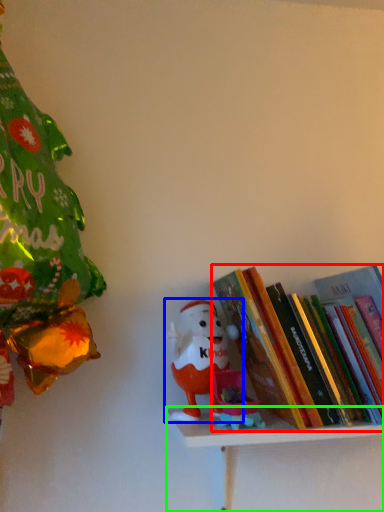
Question: Which object is the closest to the book (highlighted by a red box)? Choose among these: toy (highlighted by a blue box) or shelf (highlighted by a green box).

Choices:
 (A) toy
 (B) shelf

Answer: (B)